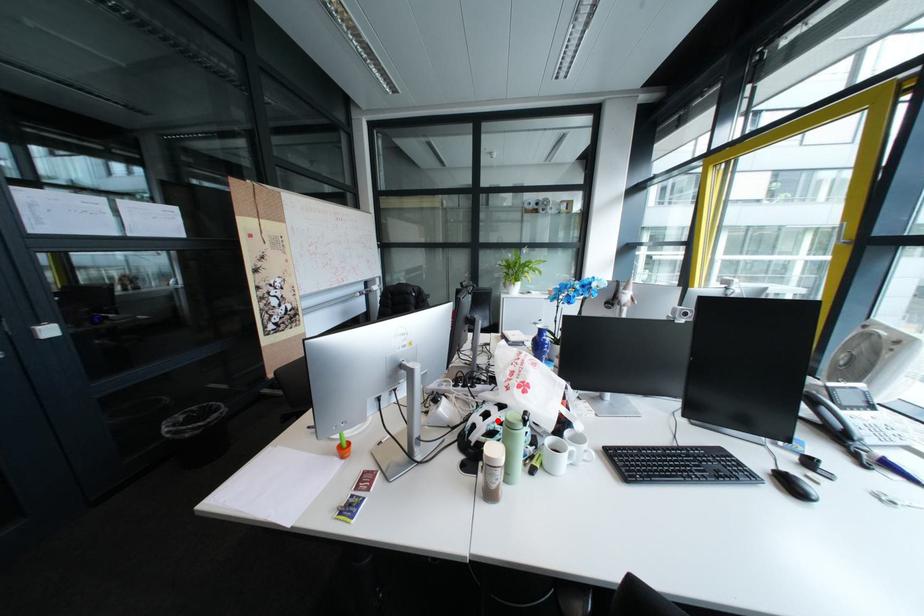
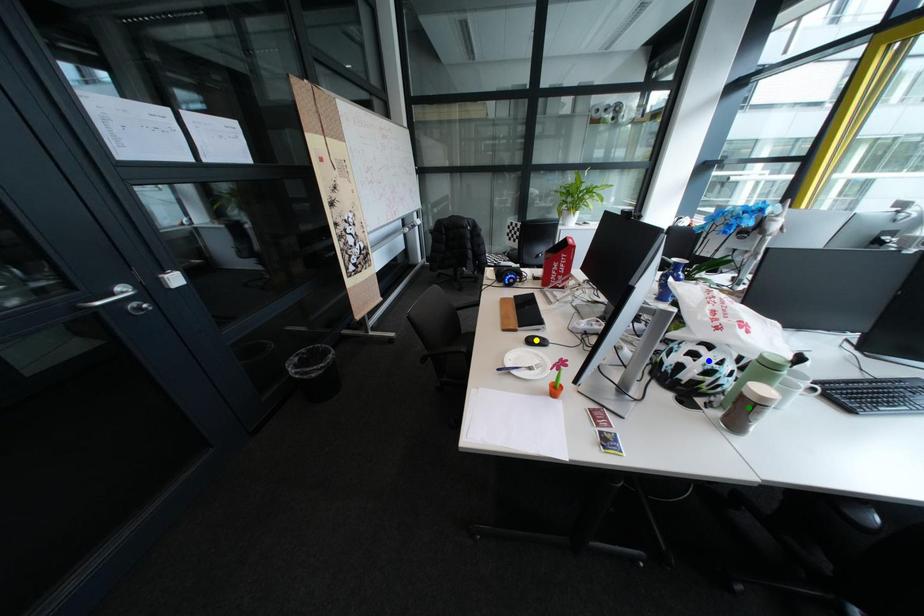
Question: I am providing you with two images of the same scene from different viewpoints. A red point is marked on the first image. You are given multiple points on the second image. In image 2, which mark is for the same physical point as the one in image 1?

Choices:
 (A) green point
 (B) yellow point
 (C) blue point

Answer: (C)